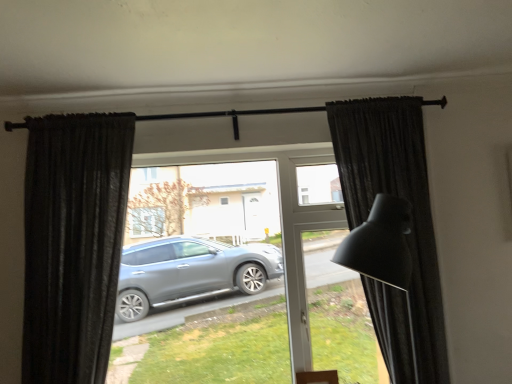
Question: Is dark matte curtain at right, the second curtain in the left-to-right sequence, far from black textured curtain at left, marked as the 2th curtain in a right-to-left arrangement?

Choices:
 (A) no
 (B) yes

Answer: (B)

Question: From the image's perspective, is dark matte curtain at right, the second curtain in the left-to-right sequence, over black textured curtain at left, marked as the 2th curtain in a right-to-left arrangement?

Choices:
 (A) yes
 (B) no

Answer: (A)

Question: From a real-world perspective, is dark matte curtain at right, the second curtain in the left-to-right sequence, positioned over black textured curtain at left, which ranks as the first curtain in left-to-right order, based on gravity?

Choices:
 (A) no
 (B) yes

Answer: (A)

Question: Can you confirm if dark matte curtain at right, which is counted as the 1th curtain, starting from the right, is wider than black textured curtain at left, marked as the 2th curtain in a right-to-left arrangement?

Choices:
 (A) no
 (B) yes

Answer: (B)

Question: Can you confirm if dark matte curtain at right, which is counted as the 1th curtain, starting from the right, is taller than black textured curtain at left, marked as the 2th curtain in a right-to-left arrangement?

Choices:
 (A) yes
 (B) no

Answer: (A)

Question: Can you confirm if dark matte curtain at right, the second curtain in the left-to-right sequence, is shorter than black textured curtain at left, marked as the 2th curtain in a right-to-left arrangement?

Choices:
 (A) yes
 (B) no

Answer: (B)

Question: Does black textured curtain at left, marked as the 2th curtain in a right-to-left arrangement, touch dark matte curtain at right, the second curtain in the left-to-right sequence?

Choices:
 (A) no
 (B) yes

Answer: (A)

Question: Is there a large distance between black textured curtain at left, which ranks as the first curtain in left-to-right order, and dark matte curtain at right, which is counted as the 1th curtain, starting from the right?

Choices:
 (A) yes
 (B) no

Answer: (A)

Question: Does black textured curtain at left, marked as the 2th curtain in a right-to-left arrangement, appear on the right side of dark matte curtain at right, the second curtain in the left-to-right sequence?

Choices:
 (A) yes
 (B) no

Answer: (B)

Question: Is black textured curtain at left, which ranks as the first curtain in left-to-right order, bigger than dark matte curtain at right, the second curtain in the left-to-right sequence?

Choices:
 (A) yes
 (B) no

Answer: (B)

Question: From a real-world perspective, is black textured curtain at left, which ranks as the first curtain in left-to-right order, positioned under dark matte curtain at right, the second curtain in the left-to-right sequence, based on gravity?

Choices:
 (A) no
 (B) yes

Answer: (A)

Question: Is black textured curtain at left, marked as the 2th curtain in a right-to-left arrangement, further to camera compared to dark matte curtain at right, the second curtain in the left-to-right sequence?

Choices:
 (A) no
 (B) yes

Answer: (B)

Question: From a real-world perspective, is black textured curtain at left, which ranks as the first curtain in left-to-right order, above or below dark matte curtain at right, which is counted as the 1th curtain, starting from the right?

Choices:
 (A) above
 (B) below

Answer: (A)